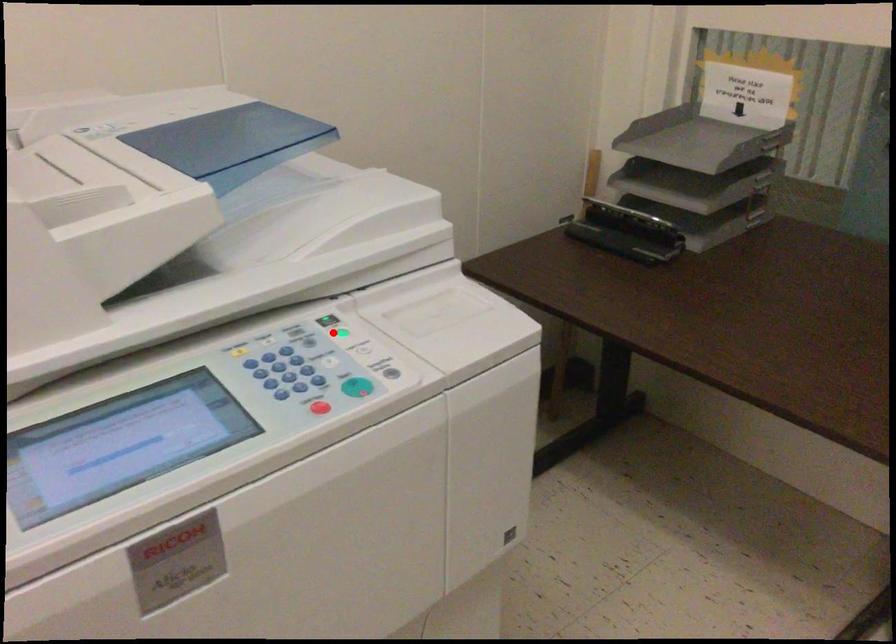
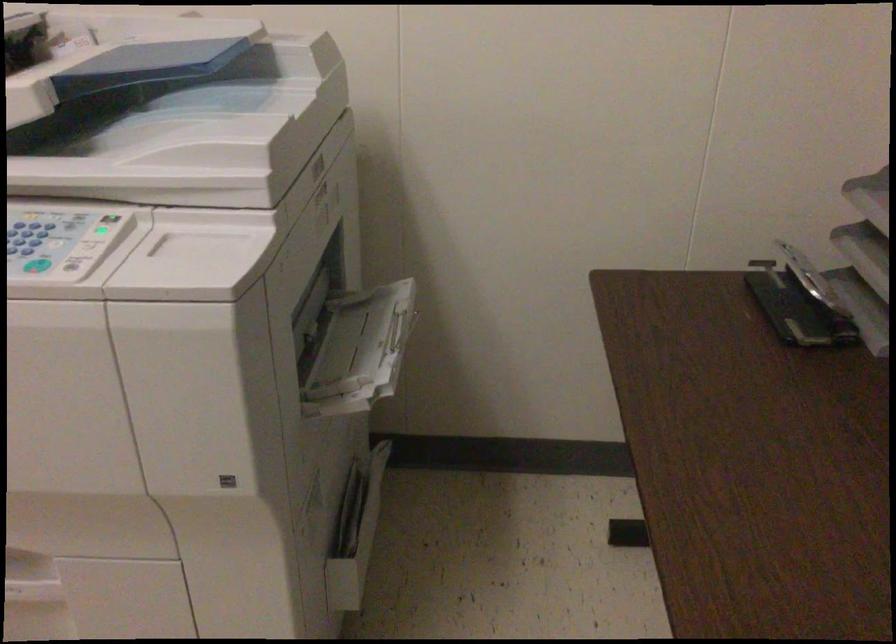
Question: I am providing you with two images of the same scene from different viewpoints. In image1, a red point is highlighted. Considering the same 3D point in image2, which of the following is correct?

Choices:
 (A) It is closer
 (B) It is farther

Answer: (B)